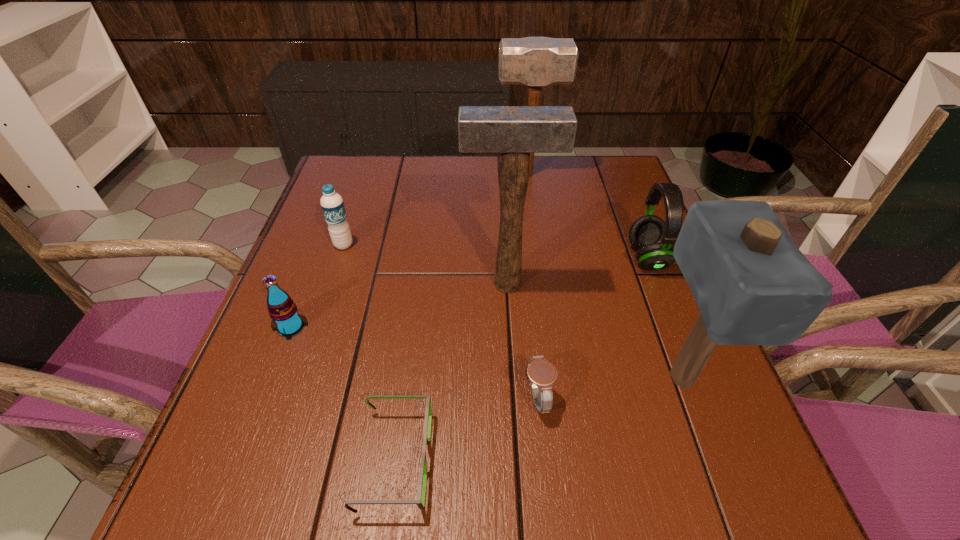
The height and width of the screenshot is (540, 960). Identify the location of free space located 0.120m on the striking face of the farthest mallet. (453, 174).

What are the coordinates of `vacant space located on the striking face of the farthest mallet` in the screenshot? It's located at coord(440,174).

Identify the location of vacant space situated 0.350m on the striking face of the farthest mallet. The image size is (960, 540). (372, 174).

You are a GUI agent. You are given a task and a screenshot of the screen. Output one action in this format:
    pyautogui.click(x=<x>, y=<y>)
    Task: Click on the vacant area situated 0.180m on the left of the rightmost mallet
    This screenshot has width=960, height=540.
    Given the screenshot: What is the action you would take?
    pyautogui.click(x=549, y=377)

Where is `vacant area situated on the ear cups of the headset`? vacant area situated on the ear cups of the headset is located at coordinates (505, 257).

The height and width of the screenshot is (540, 960). What are the coordinates of `free space located on the ear cups of the headset` in the screenshot? It's located at (515, 257).

Where is `vacant space situated on the ear cups of the headset`? This screenshot has height=540, width=960. vacant space situated on the ear cups of the headset is located at coordinates (527, 257).

At what (x,y) coordinates should I click in order to perform the action: click on vacant point located on the label of the water bottle. Please return your answer as a coordinate pair (x, y). Looking at the image, I should click on (335, 269).

Where is `free location located on the right of the sixth tallest object`? The image size is (960, 540). free location located on the right of the sixth tallest object is located at coordinates (369, 327).

Identify the location of vacant space located 0.400m on the back of the watch. (520, 232).